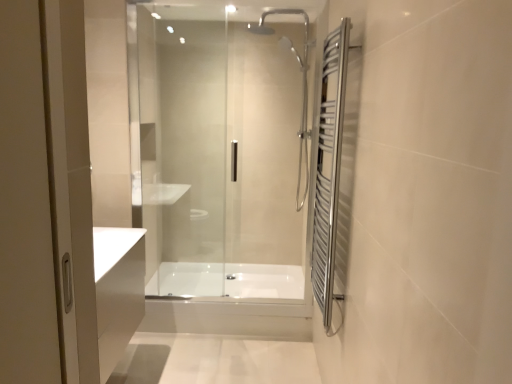
Identify the location of empty space that is ontop of white glossy bathtub at center, acting as the second bath starting from the back (from a real-world perspective). This screenshot has height=384, width=512. (227, 297).